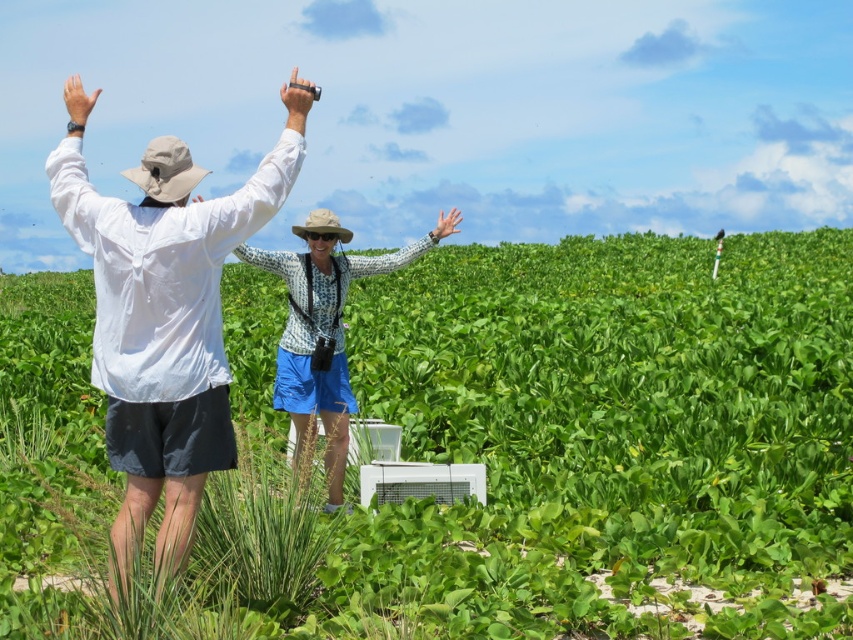
You are a photographer trying to capture a wide shot of both the patterned fabric shirt at center and the matte white hand at center in the image. Given that your camera can only focus on objects within a 1.2 meter width, can both objects fit within the frame?

The patterned fabric shirt at center is wider than the matte white hand at center. Since the camera can focus on objects within a 1.2 meter width, both objects can fit within the frame as their combined width is likely under 1.2 meters.

You are a photographer trying to capture a photo of the white matte shirt at upper left and the matte black flashlight at upper center. Based on their positions, which object is closer to the camera lens?

The white matte shirt at upper left is positioned under the matte black flashlight at upper center, meaning the flashlight is closer to the camera lens than the shirt.

You are standing in the field and want to walk directly towards the point marked as point [283,260]. Will you pass by point [460,216] before reaching your destination?

Yes, because point [283,260] is in front of point [460,216], so you will pass by point [460,216] before reaching your destination.